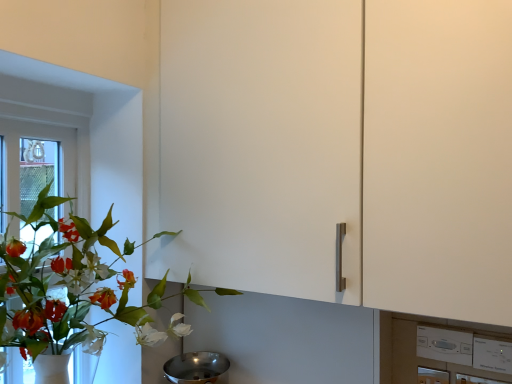
Question: From a real-world perspective, is white plastic switch at lower right positioned above or below white plastic window frame at left?

Choices:
 (A) above
 (B) below

Answer: (B)

Question: In terms of height, does white plastic switch at lower right look taller or shorter compared to white plastic window frame at left?

Choices:
 (A) tall
 (B) short

Answer: (B)

Question: Which object is positioned closest to the green matte plant at left?

Choices:
 (A) white plastic window frame at left
 (B) white plastic switch at lower right
 (C) polished stainless steel mixing bowl at lower center

Answer: (A)

Question: Based on their relative distances, which object is nearer to the green matte plant at left?

Choices:
 (A) polished stainless steel mixing bowl at lower center
 (B) white plastic switch at lower right
 (C) white plastic window frame at left

Answer: (C)